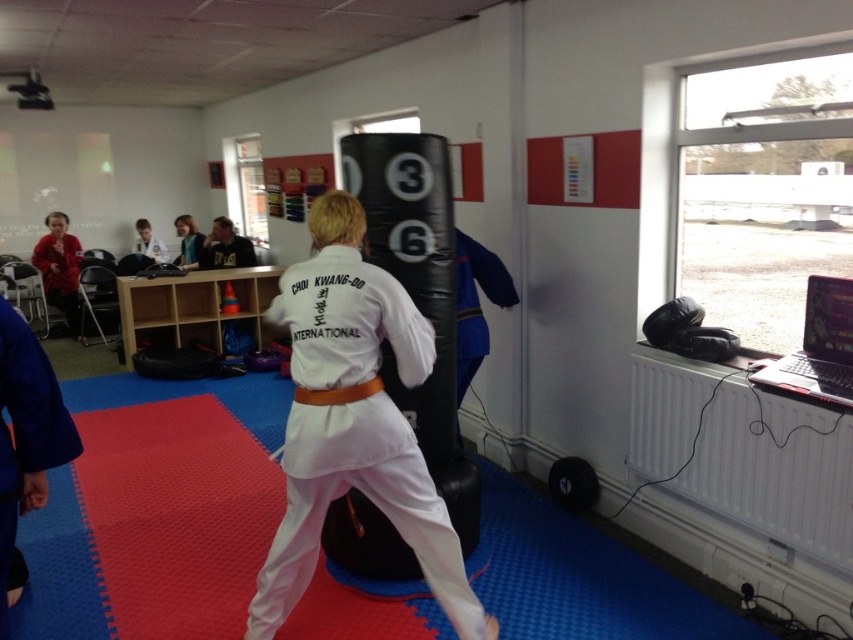
Looking at this image, you are a photographer setting up a shot in the dojo. You have two points marked on the floor at coordinates point (252, 256) and point (143, 246). Which point is closer to your camera position?

Point (252, 256) is closer to the camera than point (143, 246).

You are a martial arts instructor observing a student practicing in the dojo. You notice a specific point marked at coordinates (354, 420). Can you determine what this point is located on?

The point at coordinates (354, 420) is located on the white fabric karate gi at center.

You are observing a martial arts training session from the front of the dojo. There are two points marked in the scene. The first point is at coordinates point (x=360, y=454) and the second point is at point (x=165, y=259). Which of these two points is closer to your current position?

Point (x=360, y=454) is closer to the camera than point (x=165, y=259), so the first point is closer to your current position.